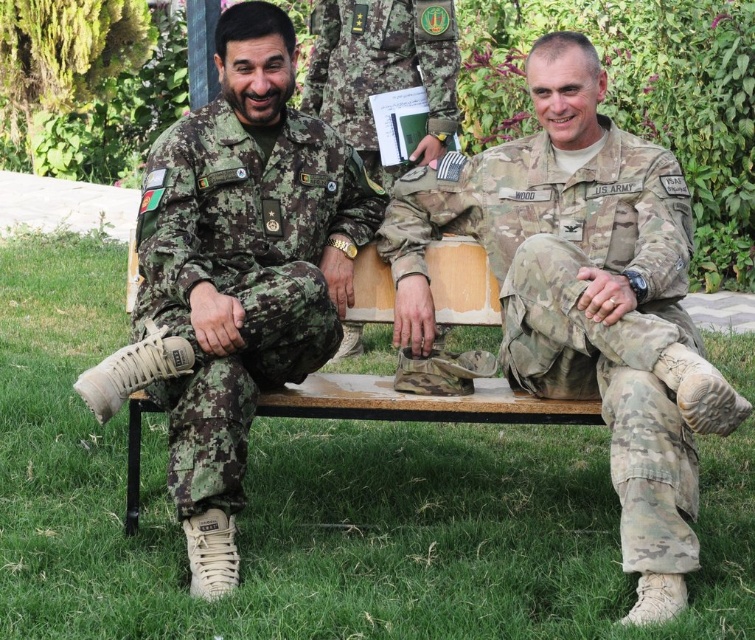
You are a tailor observing two pairs of camouflage fabric pants in the image. The first pair is labeled as camouflage fabric pants at center and the second as camouflage fabric pants at left. Based on their positions, which pair appears taller?

The camouflage fabric pants at center appears taller than the camouflage fabric pants at left.

You are designing a military display and need to arrange two items based on their sizes. The camouflage fabric pants at left and the camouflage uniform at center must be placed on a shelf. Which item should you place first if you want to arrange them from largest to smallest?

The camouflage fabric pants at left should be placed first since it is larger in size than the camouflage uniform at center.